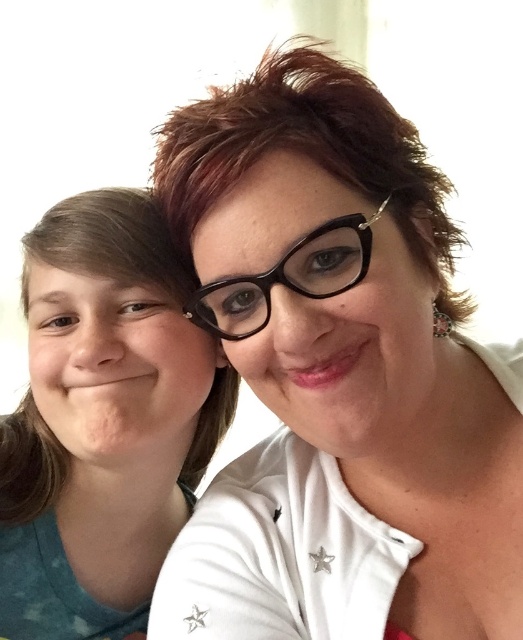
You are a photographer editing a photo of two people. You need to place a matte black glasses exactly at the center of the image. However, there is already an object at point (x=338, y=376). What object is blocking the center?

The matte black glasses at upper center is blocking the center at point (x=338, y=376).

You are trying to decide which item is bigger between the teal fabric shirt at left and the black plastic glasses at center. Based on the scene, which one is larger?

The teal fabric shirt at left is larger than the black plastic glasses at center.

You are trying to decide which pair of glasses to wear for a casual day out. You have the matte black glasses at upper center and the black plastic glasses at center. Which pair has a larger frame size?

The matte black glasses at upper center has a larger frame size than the black plastic glasses at center according to the description.